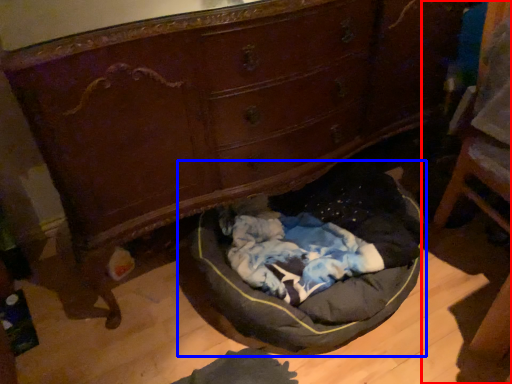
Question: Which point is further to the camera, furniture (highlighted by a red box) or dog bed (highlighted by a blue box)?

Choices:
 (A) furniture
 (B) dog bed

Answer: (B)